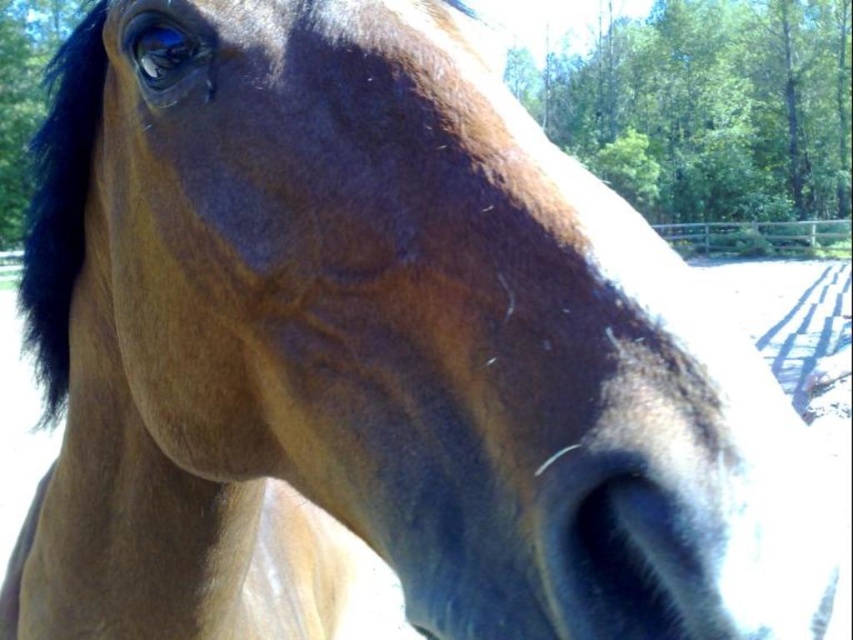
Can you confirm if black silky mane at left is positioned above brown wooden fence at upper right?

Indeed, black silky mane at left is positioned over brown wooden fence at upper right.

Is black silky mane at left behind brown wooden fence at upper right?

No, black silky mane at left is closer to the viewer.

What do you see at coordinates (61, 200) in the screenshot? Image resolution: width=853 pixels, height=640 pixels. I see `black silky mane at left` at bounding box center [61, 200].

The height and width of the screenshot is (640, 853). Find the location of `black silky mane at left`. black silky mane at left is located at coordinates (61, 200).